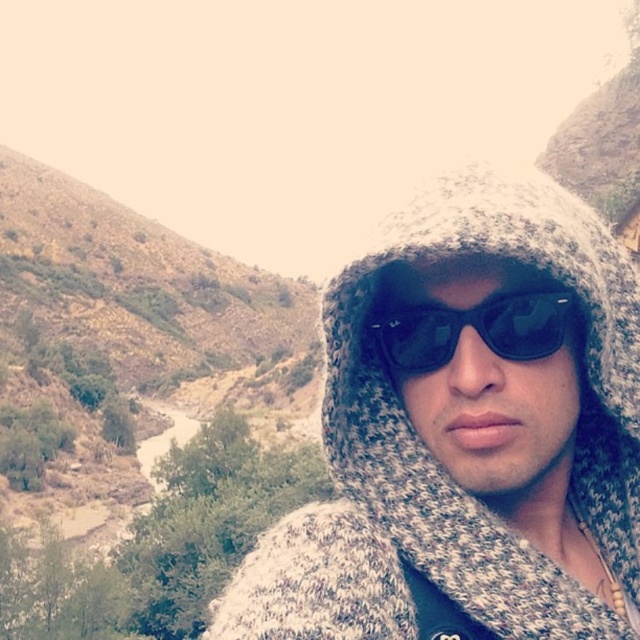
Is knitted woolen hoodie at center closer to the viewer compared to black reflective sunglasses at center?

That is True.

Does knitted woolen hoodie at center have a smaller size compared to black reflective sunglasses at center?

Actually, knitted woolen hoodie at center might be larger than black reflective sunglasses at center.

Which is behind, point (593, 442) or point (568, 298)?

Positioned behind is point (593, 442).

Locate an element on the screen. This screenshot has height=640, width=640. knitted woolen hoodie at center is located at coordinates (468, 433).